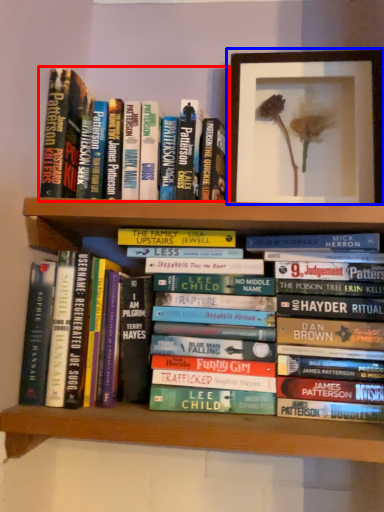
Question: Which object is further to the camera taking this photo, book (highlighted by a red box) or picture frame (highlighted by a blue box)?

Choices:
 (A) book
 (B) picture frame

Answer: (B)